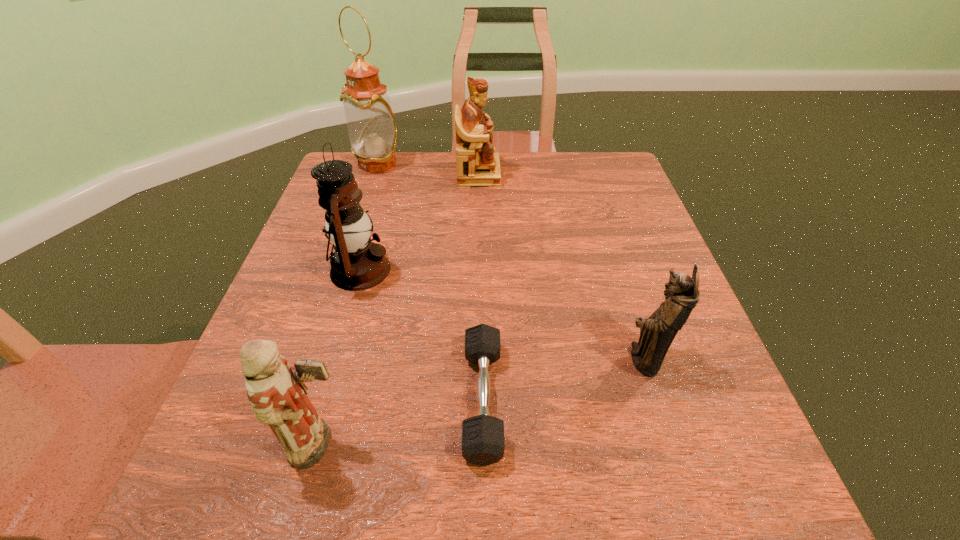
Locate an element on the screen. vacant space at the near right corner of the desktop is located at coordinates (719, 497).

This screenshot has width=960, height=540. In order to click on empty location between the dumbbell and the rightmost object in this screenshot , I will do `click(563, 379)`.

The width and height of the screenshot is (960, 540). Identify the location of empty space that is in between the second figurine from left to right and the nearest figurine. (399, 309).

The height and width of the screenshot is (540, 960). I want to click on free area in between the shortest object and the lantern, so click(x=421, y=334).

Where is `free space between the lantern and the shortest object`? This screenshot has width=960, height=540. free space between the lantern and the shortest object is located at coordinates (421, 334).

This screenshot has height=540, width=960. Identify the location of empty space that is in between the lantern and the dumbbell. (421, 334).

Locate an element on the screen. vacant region between the leftmost figurine and the lantern is located at coordinates (341, 357).

This screenshot has height=540, width=960. What are the coordinates of `free point between the tallest object and the second figurine from right to left` in the screenshot? It's located at (428, 169).

Locate an element on the screen. empty space that is in between the second figurine from left to right and the dumbbell is located at coordinates (481, 286).

Find the location of a particular element. This screenshot has width=960, height=540. vacant area between the leftmost figurine and the lantern is located at coordinates (341, 357).